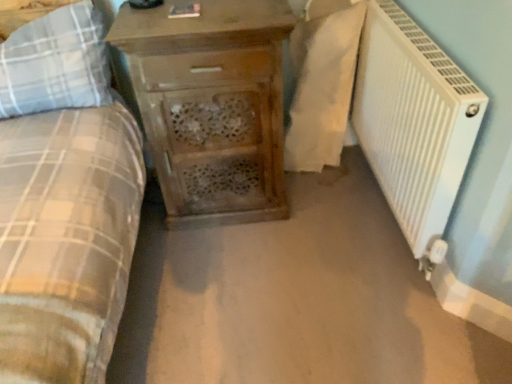
Question: From the image's perspective, would you say white textured radiator at right is positioned over wooden chest of drawers at center?

Choices:
 (A) yes
 (B) no

Answer: (B)

Question: Can we say white textured radiator at right lies outside wooden chest of drawers at center?

Choices:
 (A) yes
 (B) no

Answer: (A)

Question: Considering the relative sizes of white textured radiator at right and wooden chest of drawers at center in the image provided, is white textured radiator at right shorter than wooden chest of drawers at center?

Choices:
 (A) no
 (B) yes

Answer: (B)

Question: Is white textured radiator at right behind wooden chest of drawers at center?

Choices:
 (A) no
 (B) yes

Answer: (A)

Question: Is white textured radiator at right directly adjacent to wooden chest of drawers at center?

Choices:
 (A) yes
 (B) no

Answer: (B)

Question: Considering the positions of point (62, 71) and point (329, 51), is point (62, 71) closer or farther from the camera than point (329, 51)?

Choices:
 (A) farther
 (B) closer

Answer: (B)

Question: Looking at their shapes, would you say plaid fabric pillow at left is wider or thinner than white fabric at right?

Choices:
 (A) thin
 (B) wide

Answer: (B)

Question: In terms of size, does plaid fabric pillow at left appear bigger or smaller than white fabric at right?

Choices:
 (A) big
 (B) small

Answer: (B)

Question: Visually, is plaid fabric pillow at left positioned to the left or to the right of white fabric at right?

Choices:
 (A) left
 (B) right

Answer: (A)

Question: From the image's perspective, is plaid fabric pillow at left positioned above or below white textured radiator at right?

Choices:
 (A) above
 (B) below

Answer: (A)

Question: Considering the positions of plaid fabric pillow at left and white textured radiator at right in the image, is plaid fabric pillow at left taller or shorter than white textured radiator at right?

Choices:
 (A) tall
 (B) short

Answer: (B)

Question: In the image, is plaid fabric pillow at left on the left side or the right side of white textured radiator at right?

Choices:
 (A) left
 (B) right

Answer: (A)

Question: Which is correct: plaid fabric pillow at left is inside white textured radiator at right, or outside of it?

Choices:
 (A) inside
 (B) outside

Answer: (B)

Question: Looking at the image, does wooden chest of drawers at center seem bigger or smaller compared to white textured radiator at right?

Choices:
 (A) small
 (B) big

Answer: (B)

Question: Is wooden chest of drawers at center inside or outside of white textured radiator at right?

Choices:
 (A) outside
 (B) inside

Answer: (A)